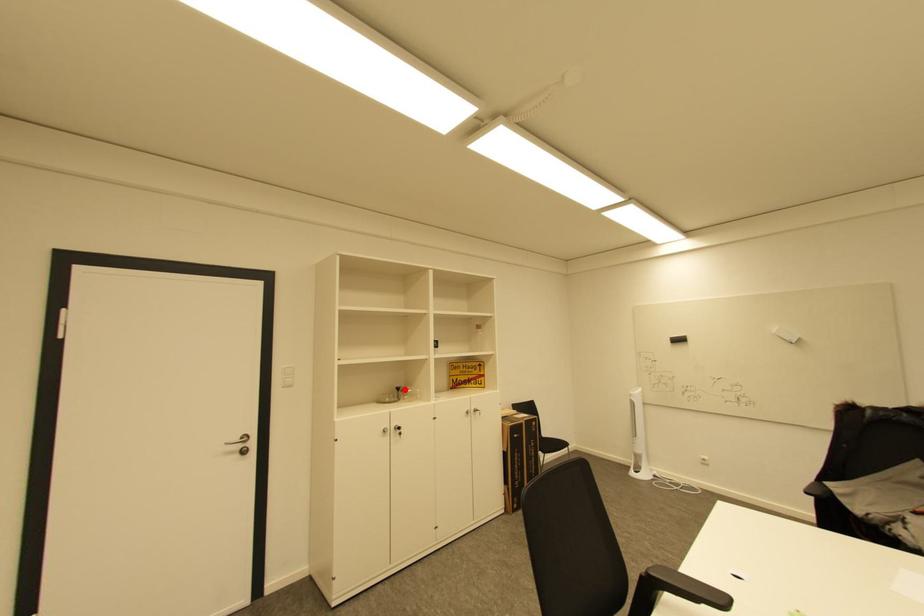
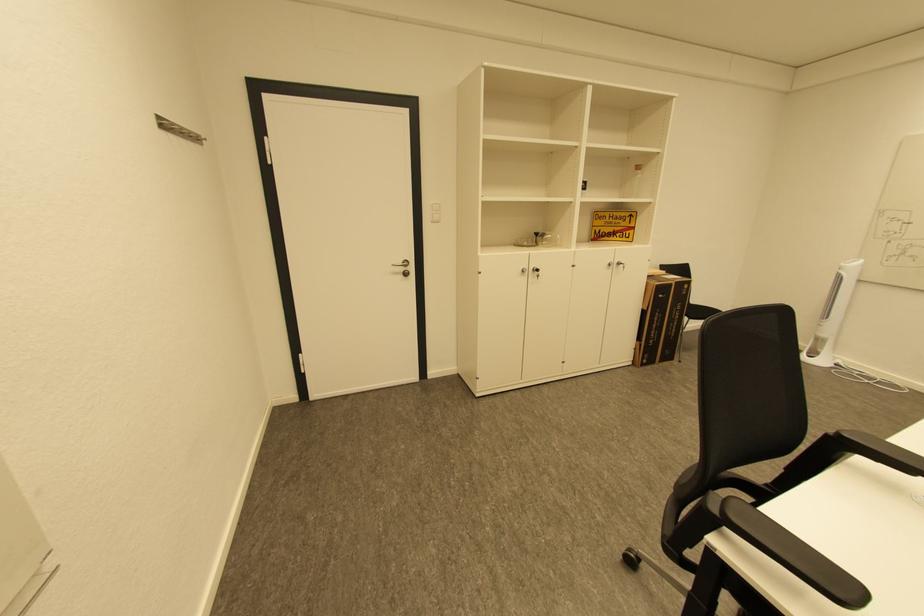
Where in the second image is the point corresponding to the highlighted location from the first image?

(543, 235)